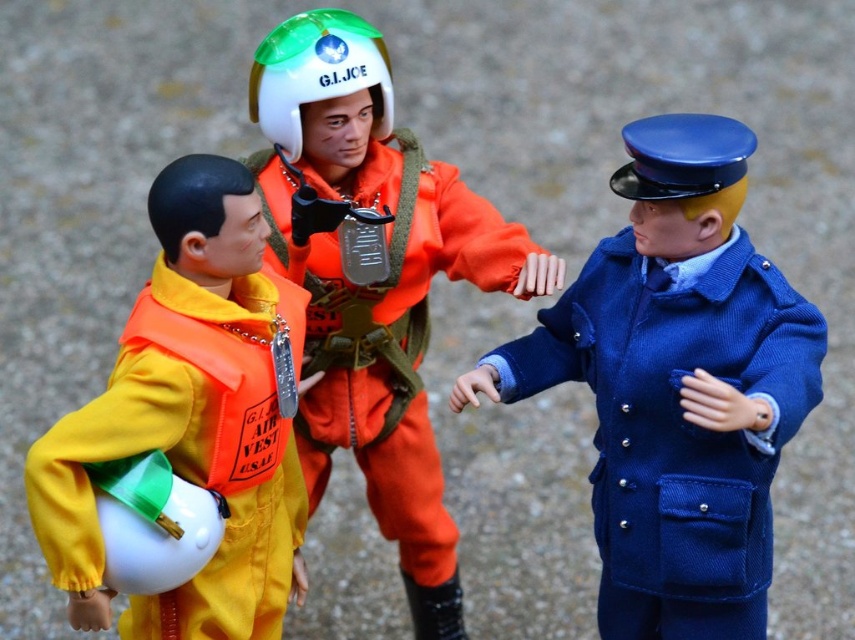
You are a collector organizing action figures and notice two items in the scene. Which item is located to the right of the other? The items are the blue woolen coat at center and the orange fabric life vest at left.

The blue woolen coat at center is positioned on the right side of orange fabric life vest at left, so the blue woolen coat at center is to the right of the orange fabric life vest at left.

What is the location of the point labeled as coordinates (x=375, y=280) in the image?

The point labeled as coordinates (x=375, y=280) is located on the orange matte jumpsuit at center.

Based on the scene described, which of the two points, point 1 at coordinates [591,289] or point 2 at coordinates [57,541], is positioned further back from the viewer?

Point 1 at coordinates [591,289] is positioned further back from the viewer than point 2 at coordinates [57,541].